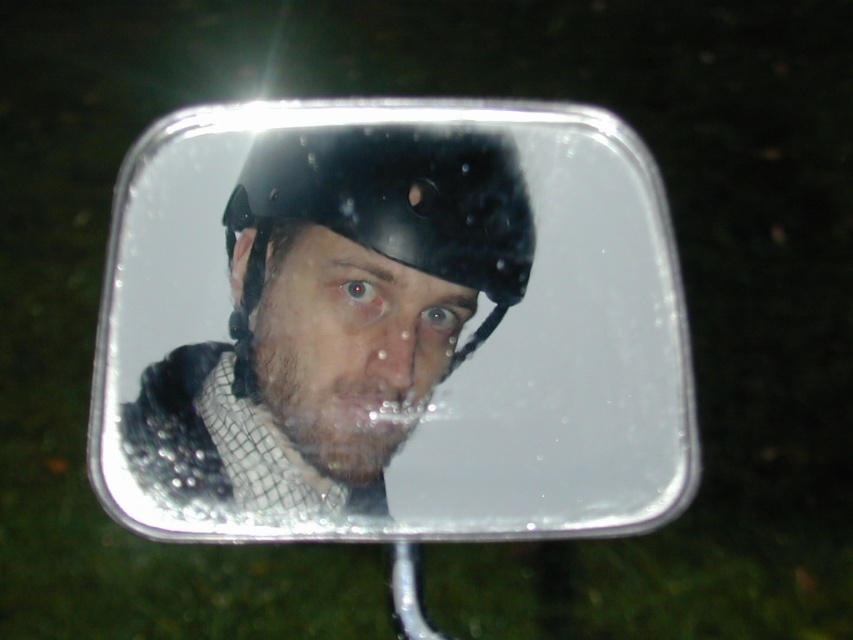
Looking at this image, between matte black helmet at center and shiny black helmet at center, which one has more height?

matte black helmet at center

Does matte black helmet at center appear under shiny black helmet at center?

Actually, matte black helmet at center is above shiny black helmet at center.

Which is behind, point (326, 132) or point (338, 304)?

Positioned behind is point (326, 132).

You are a GUI agent. You are given a task and a screenshot of the screen. Output one action in this format:
    pyautogui.click(x=<x>, y=<y>)
    Task: Click on the matte black helmet at center
    
    Given the screenshot: What is the action you would take?
    (x=335, y=314)